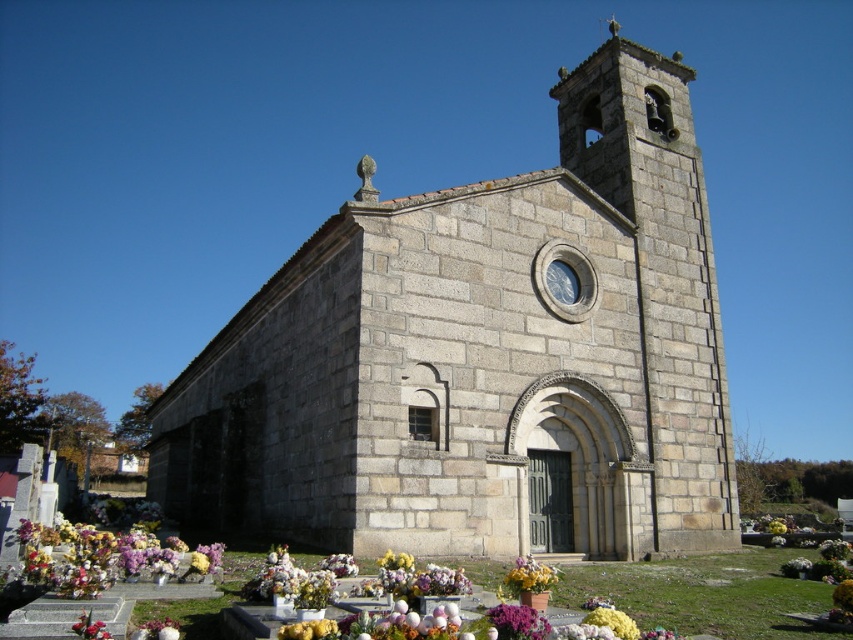
Question: In this image, where is gray stone church at center located relative to purple matte flower at lower center?

Choices:
 (A) above
 (B) below

Answer: (A)

Question: Which point appears closest to the camera in this image?

Choices:
 (A) (676, 300)
 (B) (548, 580)
 (C) (125, 536)

Answer: (B)

Question: Is gray stone church at center positioned in front of white floral bouquet at center?

Choices:
 (A) yes
 (B) no

Answer: (A)

Question: Considering the relative positions of purple matte flower at lower center and white floral bouquet at center in the image provided, where is purple matte flower at lower center located with respect to white floral bouquet at center?

Choices:
 (A) right
 (B) left

Answer: (B)

Question: Which object is farther from the camera taking this photo?

Choices:
 (A) multicolored floral bouquet at lower left
 (B) yellow matte flower at lower center
 (C) fluffy silk flower at lower left
 (D) gray stone church at center

Answer: (D)

Question: Which of these objects is positioned farthest from the fluffy silk flower at lower left?

Choices:
 (A) purple matte flower at lower center
 (B) white floral bouquet at center
 (C) gray stone church at center

Answer: (B)